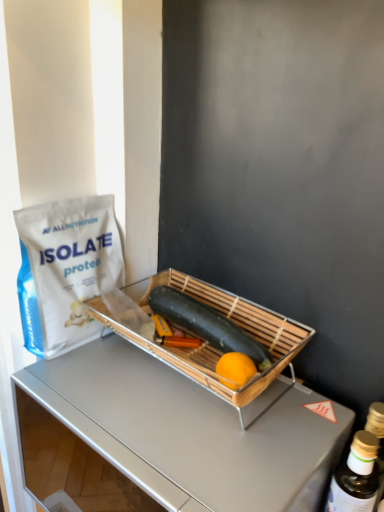
I want to click on blank space above metallic silver desk at center (from a real-world perspective), so click(x=163, y=411).